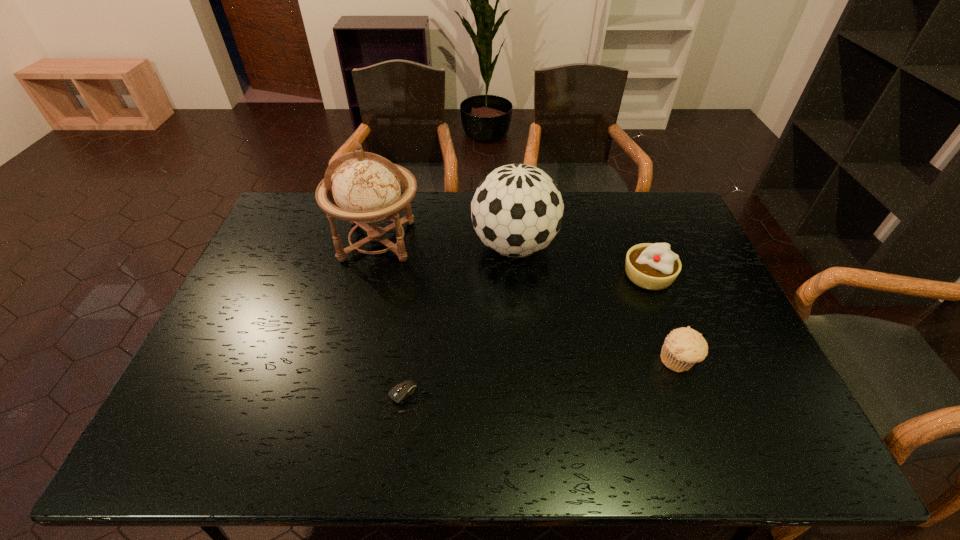
Image resolution: width=960 pixels, height=540 pixels. What are the coordinates of `vacant space at the left edge of the desktop` in the screenshot? It's located at (277, 294).

The width and height of the screenshot is (960, 540). What are the coordinates of `vacant area at the right edge of the desktop` in the screenshot? It's located at (697, 262).

You are a GUI agent. You are given a task and a screenshot of the screen. Output one action in this format:
    pyautogui.click(x=<x>, y=<y>)
    Task: Click on the free spot at the far right corner of the desktop
    This screenshot has width=960, height=540.
    Given the screenshot: What is the action you would take?
    pyautogui.click(x=658, y=224)

Locate an element on the screen. unoccupied position between the globe and the nearest object is located at coordinates (391, 324).

You are a GUI agent. You are given a task and a screenshot of the screen. Output one action in this format:
    pyautogui.click(x=<x>, y=<y>)
    Task: Click on the free area in between the second shortest object and the whipped cream
    
    Given the screenshot: What is the action you would take?
    pyautogui.click(x=663, y=318)

Locate an element on the screen. free point between the fourth shortest object and the computer mouse is located at coordinates (459, 327).

Image resolution: width=960 pixels, height=540 pixels. What are the coordinates of `free space between the tallest object and the soccer ball` in the screenshot? It's located at (446, 244).

Find the location of a particular element. blank region between the nearest object and the third tallest object is located at coordinates (525, 342).

Where is `free space between the tallest object and the muffin`? This screenshot has width=960, height=540. free space between the tallest object and the muffin is located at coordinates click(x=528, y=301).

Locate an element on the screen. This screenshot has width=960, height=540. unoccupied position between the globe and the whipped cream is located at coordinates (513, 258).